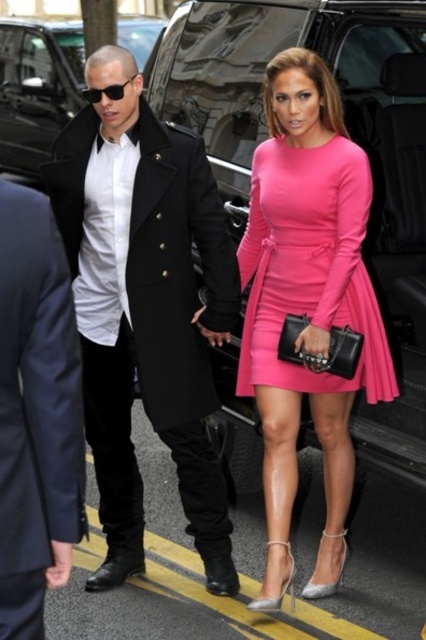
You are a photographer positioned behind the two individuals and want to capture a clear shot of the pink satin dress at center and the matte pink dress at center. Which dress will appear larger in the photo?

The pink satin dress at center will appear larger in the photo because it is closer to the viewer than the matte pink dress at center.

You are a photographer standing 10 feet away from the pink satin dress at center. Can you take a clear photo of the dress without moving closer?

The photographer is 10 feet away from the pink satin dress at center, and they are 9.98 feet apart. Since the distance is almost exactly 10 feet, the photographer can take a clear photo of the dress without needing to move closer.

You are a photographer trying to capture a photo of the matte black coat at left and the pink satin dress at center. Since you want to ensure both are visible in the frame, which object should you focus on first to account for their sizes?

The matte black coat at left has a lesser height compared to the pink satin dress at center, so you should focus on the pink satin dress at center first to ensure it fits properly in the frame.